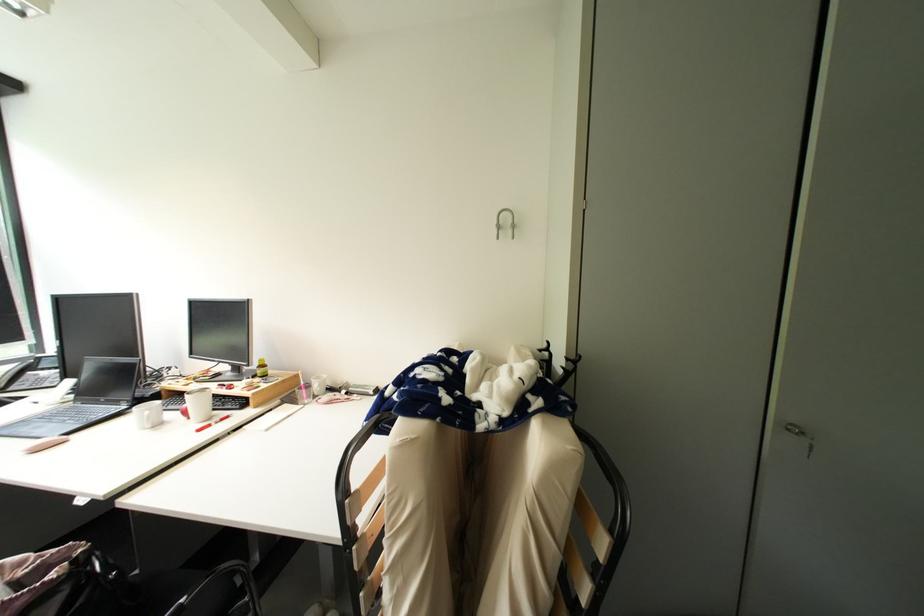
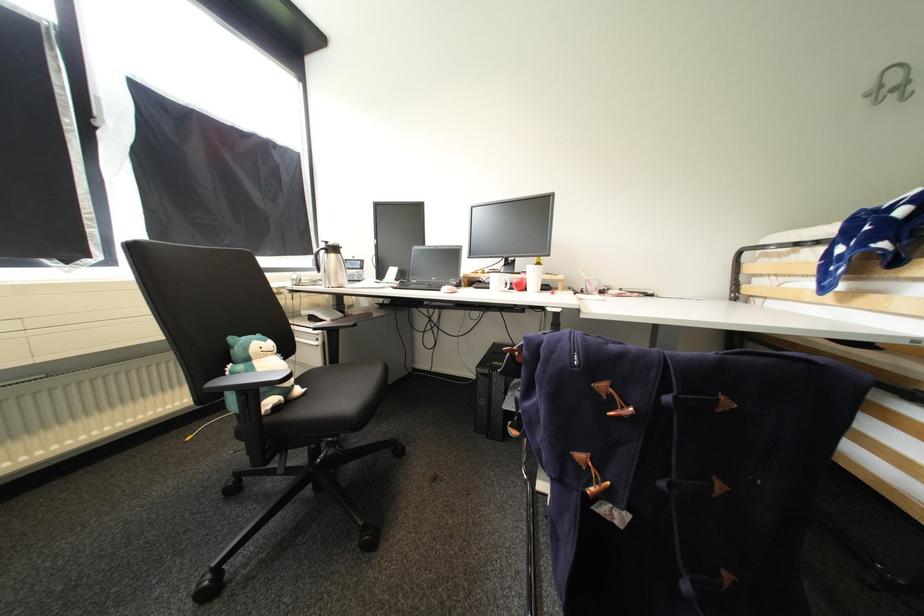
Question: What movement of the cameraman would produce the second image?

Choices:
 (A) Left
 (B) Right
 (C) Forward
 (D) Backward

Answer: (A)